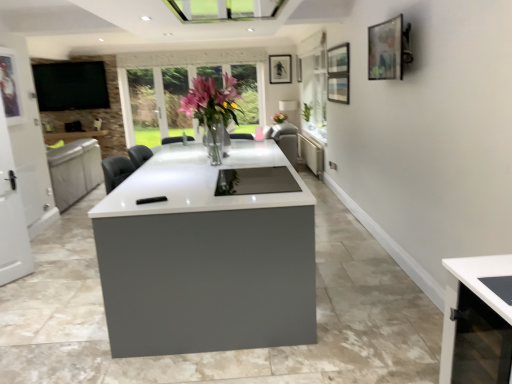
Question: Could you tell me if green leafy plant at center is turned towards matte gray radiator at center?

Choices:
 (A) yes
 (B) no

Answer: (B)

Question: Is green leafy plant at center outside of matte gray radiator at center?

Choices:
 (A) yes
 (B) no

Answer: (A)

Question: From a real-world perspective, does green leafy plant at center sit lower than matte gray radiator at center?

Choices:
 (A) no
 (B) yes

Answer: (A)

Question: From the image's perspective, would you say green leafy plant at center is shown under matte gray radiator at center?

Choices:
 (A) yes
 (B) no

Answer: (B)

Question: Is green leafy plant at center placed right next to matte gray radiator at center?

Choices:
 (A) no
 (B) yes

Answer: (A)

Question: Is the depth of green leafy plant at center greater than that of matte gray radiator at center?

Choices:
 (A) no
 (B) yes

Answer: (B)

Question: From the image's perspective, does metallic silver picture frame at left, arranged as the fourth picture frame when viewed from the top, appear higher than matte black picture frame at upper center, which is counted as the third picture frame, starting from the right?

Choices:
 (A) no
 (B) yes

Answer: (A)

Question: From a real-world perspective, is metallic silver picture frame at left, which is the 3th picture frame from back to front, physically below matte black picture frame at upper center, which is counted as the third picture frame, starting from the right?

Choices:
 (A) no
 (B) yes

Answer: (B)

Question: Could you tell me if metallic silver picture frame at left, marked as the 1th picture frame in a left-to-right arrangement, is facing matte black picture frame at upper center, which ranks as the fourth picture frame in bottom-to-top order?

Choices:
 (A) yes
 (B) no

Answer: (B)

Question: Would you say metallic silver picture frame at left, which appears as the 1th picture frame when ordered from the bottom, is outside matte black picture frame at upper center, which is counted as the 1th picture frame, starting from the top?

Choices:
 (A) yes
 (B) no

Answer: (A)

Question: From the image's perspective, is metallic silver picture frame at left, marked as the 1th picture frame in a left-to-right arrangement, beneath matte black picture frame at upper center, the 2th picture frame viewed from the left?

Choices:
 (A) yes
 (B) no

Answer: (A)

Question: Can you confirm if metallic silver picture frame at left, acting as the 2th picture frame starting from the front, is bigger than matte black picture frame at upper center, positioned as the 1th picture frame in back-to-front order?

Choices:
 (A) no
 (B) yes

Answer: (B)

Question: Can you confirm if matte black tv at upper left is shorter than matte black picture frame at upper center, positioned as the 1th picture frame in back-to-front order?

Choices:
 (A) yes
 (B) no

Answer: (B)